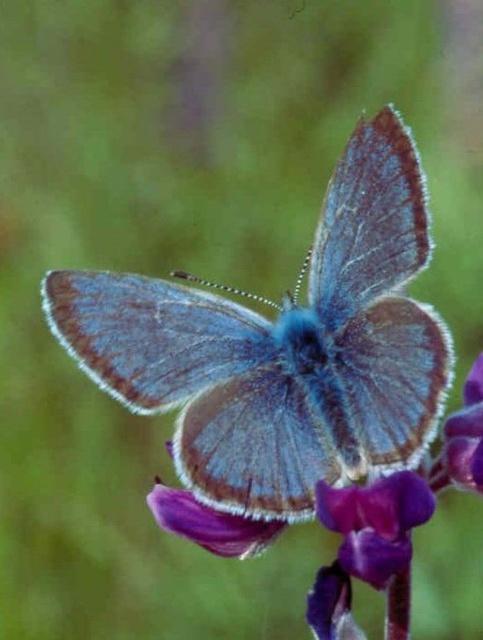
Question: Does fuzzy blue butterfly at center have a greater width compared to purple velvet flower at center?

Choices:
 (A) yes
 (B) no

Answer: (A)

Question: Which point is closer to the camera?

Choices:
 (A) (420, 477)
 (B) (208, 428)

Answer: (A)

Question: Is fuzzy blue butterfly at center closer to the viewer compared to purple velvet flower at center?

Choices:
 (A) no
 (B) yes

Answer: (A)

Question: Can you confirm if fuzzy blue butterfly at center is positioned to the left of purple velvet flower at center?

Choices:
 (A) no
 (B) yes

Answer: (B)